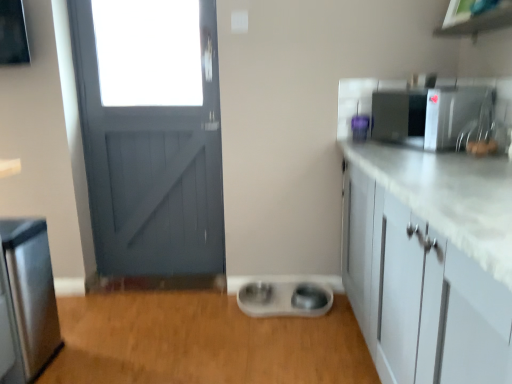
You are a GUI agent. You are given a task and a screenshot of the screen. Output one action in this format:
    pyautogui.click(x=<x>, y=<y>)
    Task: Click on the vacant space behind stainless steel refrigerator at left, placed as the 3th appliance when sorted from top to bottom
    Image resolution: width=512 pixels, height=384 pixels.
    Given the screenshot: What is the action you would take?
    pos(78,324)